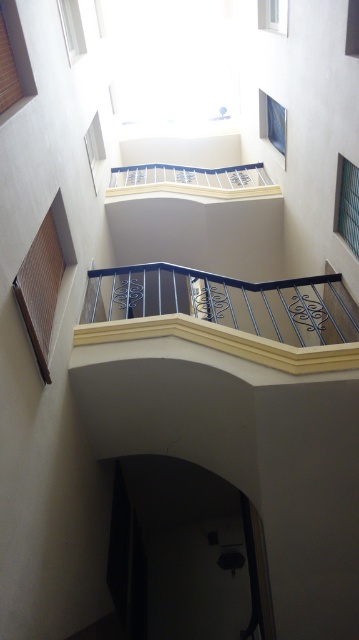
Question: Is white metal balcony at upper center above clear glass window at upper right?

Choices:
 (A) yes
 (B) no

Answer: (A)

Question: Which object appears closest to the camera in this image?

Choices:
 (A) clear glass window at upper center
 (B) metallic wrought iron balcony at center
 (C) white metal balcony at upper center

Answer: (A)

Question: Which of these objects is positioned farthest from the brown woven mat at upper left?

Choices:
 (A) clear glass window at upper center
 (B) clear glass window at upper right

Answer: (A)

Question: Which of the following is the farthest from the observer?

Choices:
 (A) (75, 8)
 (B) (36, 349)
 (C) (218, 333)

Answer: (A)

Question: Does metallic wrought iron balcony at center have a greater width compared to clear glass window at upper right?

Choices:
 (A) yes
 (B) no

Answer: (A)

Question: Is white metal balcony at upper center smaller than clear glass window at upper left?

Choices:
 (A) yes
 (B) no

Answer: (B)